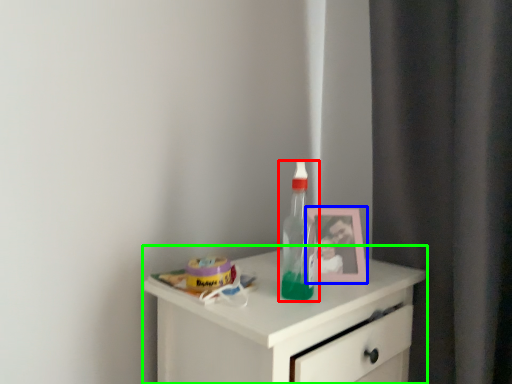
Question: Estimate the real-world distances between objects in this image. Which object is farther from bottle (highlighted by a red box), picture frame (highlighted by a blue box) or chest of drawers (highlighted by a green box)?

Choices:
 (A) picture frame
 (B) chest of drawers

Answer: (B)